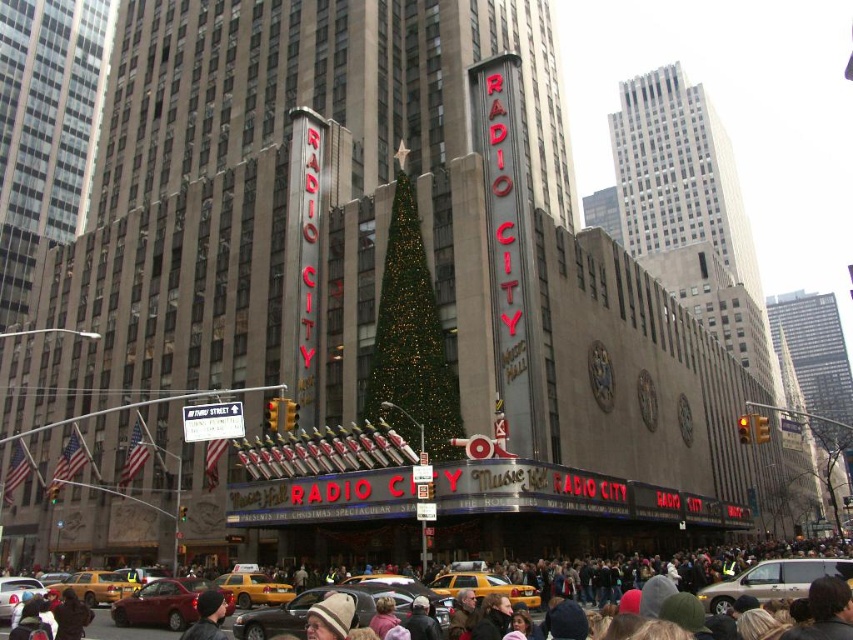
You are standing at the entrance of Radio City Music Hall and see the yellow metallic taxi at center. If you want to take a photo of the taxi with the iconic Radio City Music Hall building in the background, where should you position yourself relative to the taxi?

Since the yellow metallic taxi at center is located at point (x=485, y=588), you should position yourself behind the taxi, ensuring the building is visible behind it in the frame.

You are standing at the entrance of Radio City Music Hall and want to hail a taxi. According to the scene, where should you look to find the yellow rubber taxi at lower center?

The yellow rubber taxi at lower center is located at the coordinates point (254,588).